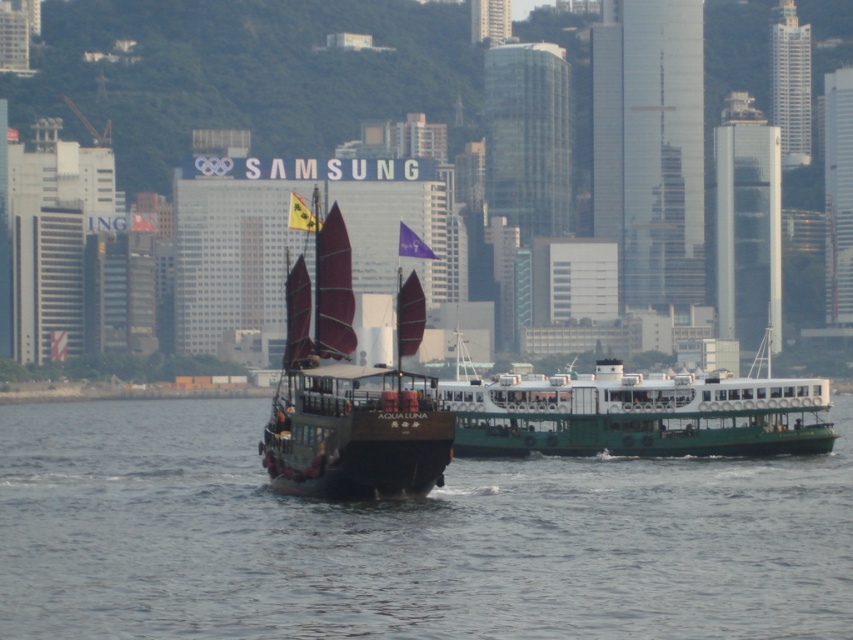
Question: Which of the following is the closest to the observer?

Choices:
 (A) (798, 397)
 (B) (397, 353)
 (C) (633, 625)

Answer: (C)

Question: Is smooth water at center below dark brown wooden sailboat at center?

Choices:
 (A) yes
 (B) no

Answer: (A)

Question: Is smooth water at center bigger than green matte ferry at center?

Choices:
 (A) yes
 (B) no

Answer: (A)

Question: Which point is farther from the camera taking this photo?

Choices:
 (A) (459, 502)
 (B) (779, 451)

Answer: (B)

Question: Which point is farther to the camera?

Choices:
 (A) (527, 401)
 (B) (398, 364)

Answer: (A)

Question: Considering the relative positions of smooth water at center and green matte ferry at center in the image provided, where is smooth water at center located with respect to green matte ferry at center?

Choices:
 (A) above
 (B) below

Answer: (B)